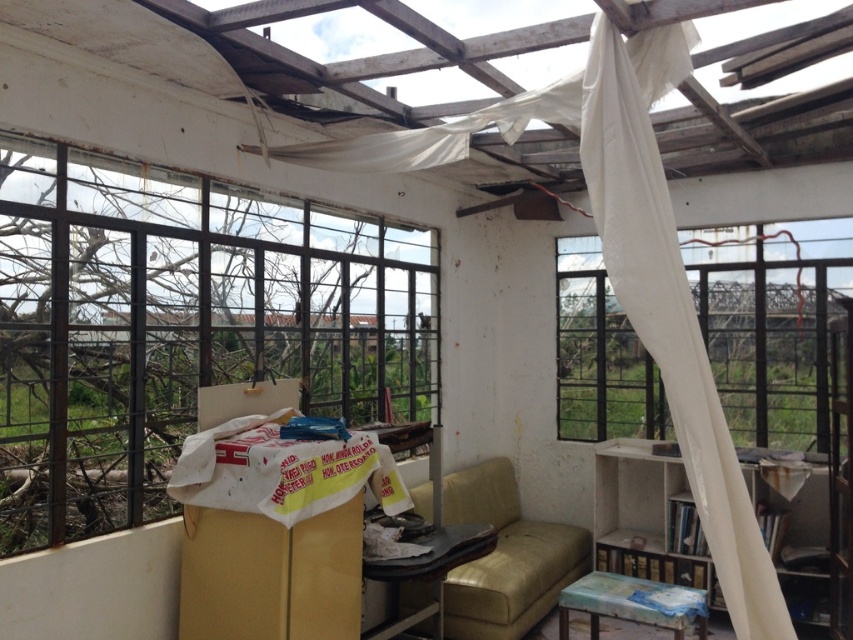
You are standing in the damaged room and want to move from the wooden bookshelf at lower right to the leather couch at center. Which direction should you move to reach it?

The wooden bookshelf at lower right is positioned over the leather couch at center, so you should move downward to reach the leather couch at center.

You are moving a large painting that is 2 meters wide. You want to place it against a wall in this room. Which object, the wooden bookshelf at lower right or the leather couch at center, would you place it next to if you need more space?

The leather couch at center has a greater width than the wooden bookshelf at lower right, so you should place the large painting next to the leather couch at center to accommodate the required space.

Based on the photo, you are a contractor assessing the structural integrity of the room. You notice the transparent plastic window at right and the leather couch at center. Which object is more likely to be a temporary addition to the space?

The transparent plastic window at right is thinner than the leather couch at center, so it is more likely to be a temporary addition to the space.